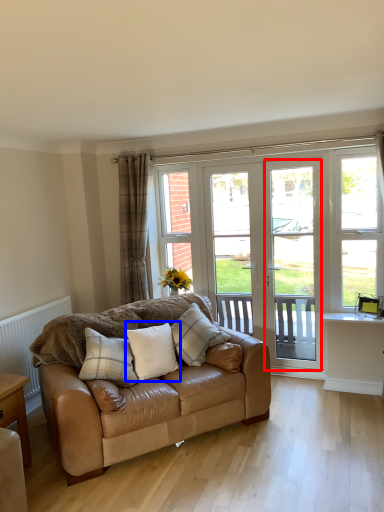
Question: Which object is further to the camera taking this photo, screen door (highlighted by a red box) or pillow (highlighted by a blue box)?

Choices:
 (A) screen door
 (B) pillow

Answer: (A)